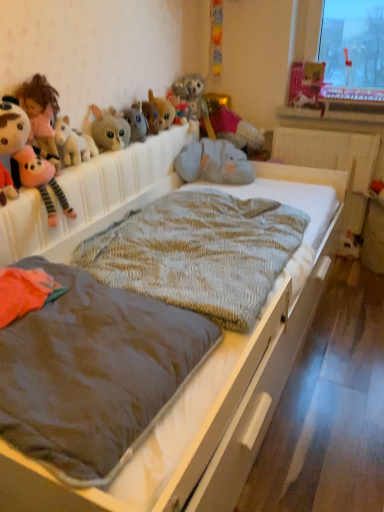
Question: Based on their sizes in the image, would you say matte pink castle at upper right, which is the eighth toy from left to right, is bigger or smaller than soft plush toy at left, the eighth toy from the right?

Choices:
 (A) small
 (B) big

Answer: (B)

Question: From a real-world perspective, is matte pink castle at upper right, placed as the 1th toy when sorted from right to left, positioned above or below soft plush toy at left, the eighth toy from the right?

Choices:
 (A) above
 (B) below

Answer: (A)

Question: Considering the real-world distances, which object is farthest from the gray plush elephant at center?

Choices:
 (A) fluffy plush toy at left, which is the second toy from left to right
 (B) matte pink castle at upper right, placed as the 1th toy when sorted from right to left
 (C) white textured radiator at center
 (D) knitted fabric bed at center
 (E) knitted woolen blanket at center, which appears as the 1th blanket when viewed from the back

Answer: (A)

Question: Which object is positioned farthest from the knitted woolen blanket at center, the first blanket in the front-to-back sequence?

Choices:
 (A) fuzzy fabric stuffed rabbit at upper center, arranged as the third toy when viewed from the left
 (B) soft plush doll at upper left
 (C) matte pink castle at upper right, which is the eighth toy from left to right
 (D) gray plush elephant at center
 (E) white plastic window sill at upper center

Answer: (C)